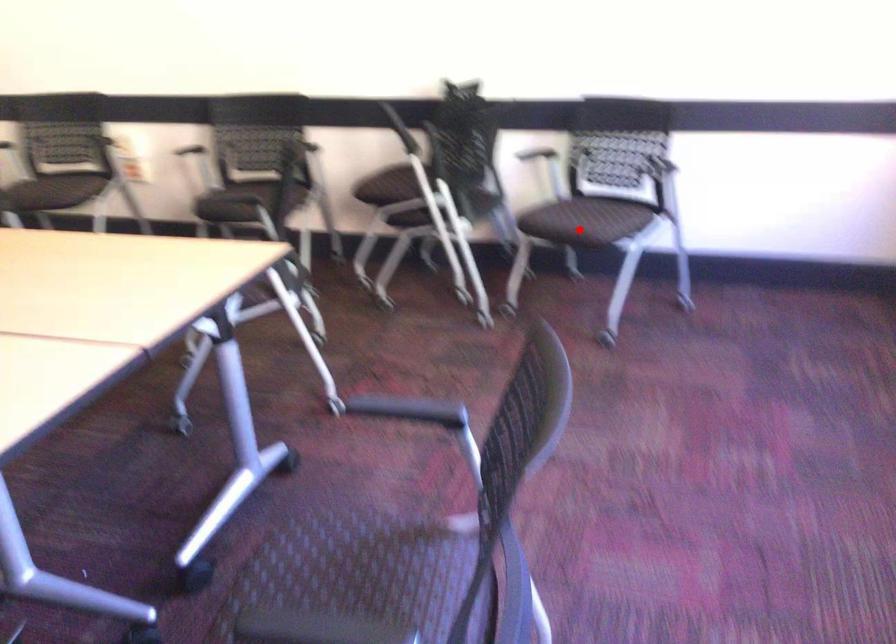
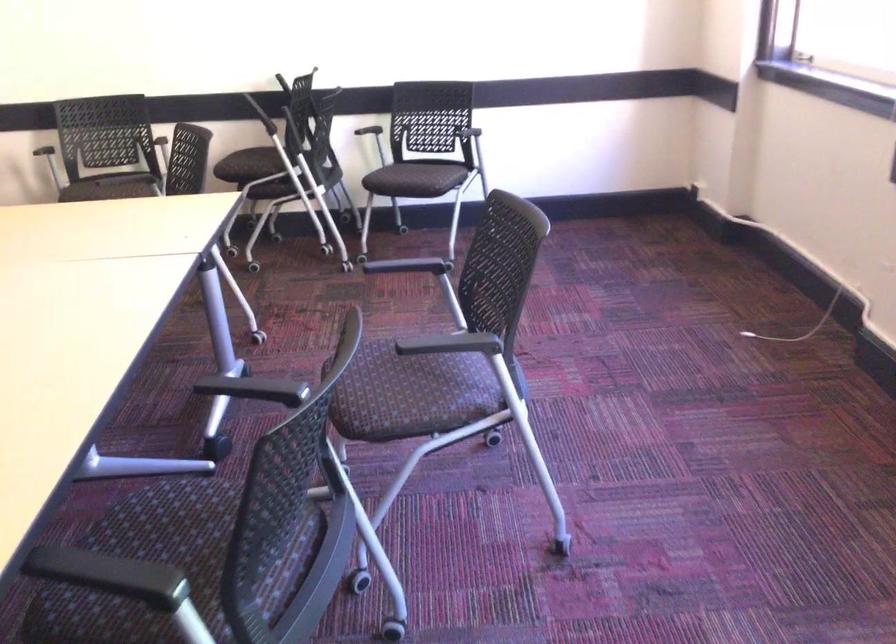
Question: I am providing you with two images of the same scene from different viewpoints. A red point is marked on the first image. Is the red point's position out of view in image 2?

Choices:
 (A) Yes
 (B) No

Answer: (B)